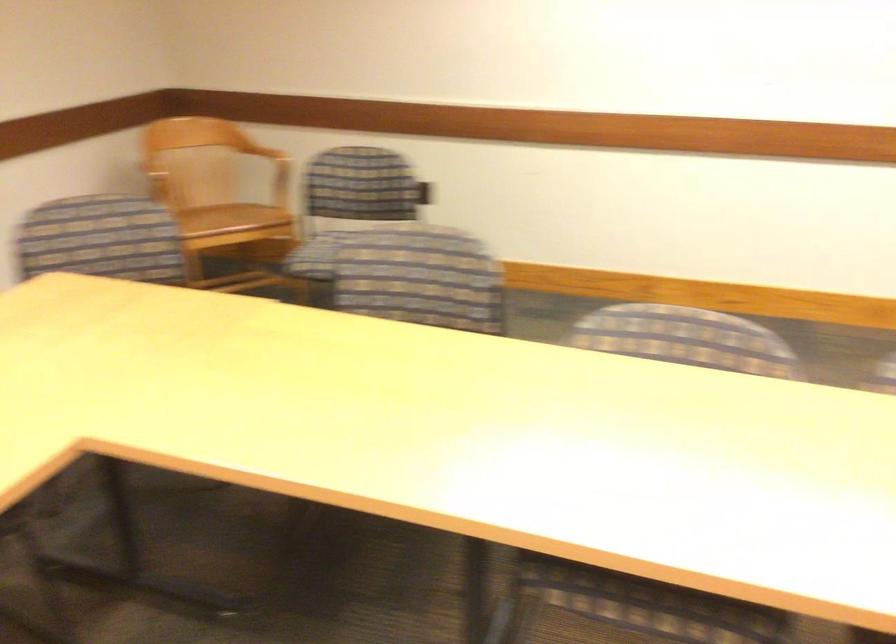
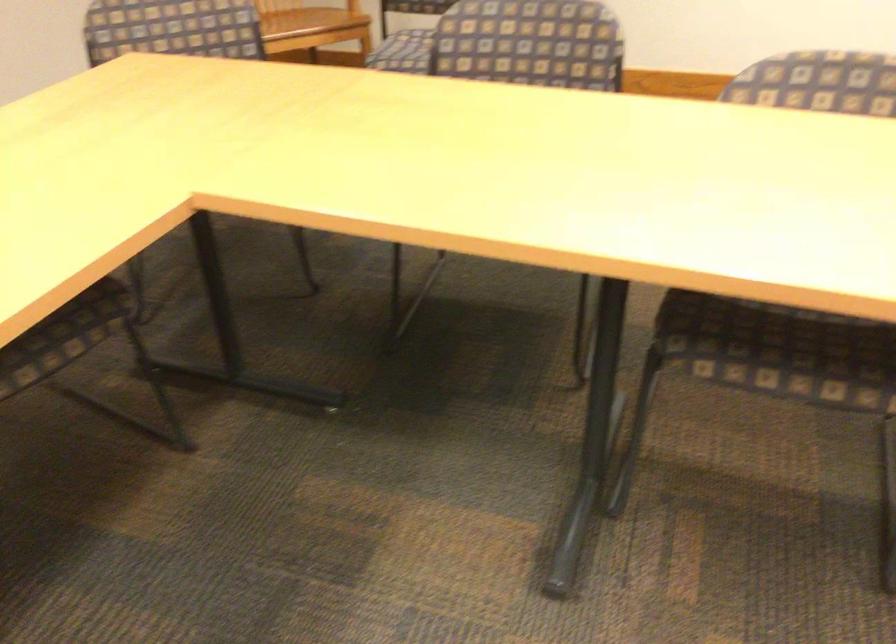
Locate, in the second image, the point that corresponds to (280,203) in the first image.

(352, 6)